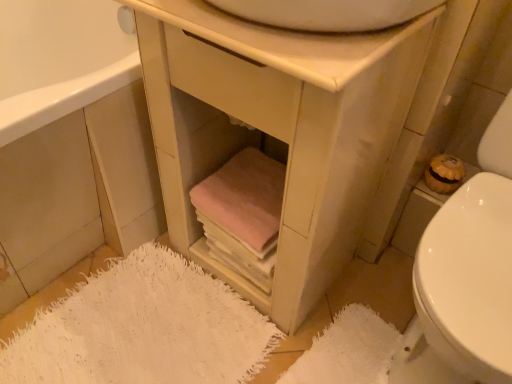
Question: Does white textured bath mat at lower right, the 1th bath mat positioned from the right, have a greater height compared to matte white vanity at center?

Choices:
 (A) no
 (B) yes

Answer: (A)

Question: Does white textured bath mat at lower right, the 2th bath mat positioned from the left, come in front of matte white vanity at center?

Choices:
 (A) yes
 (B) no

Answer: (B)

Question: Is white textured bath mat at lower right, the 1th bath mat positioned from the right, wider than matte white vanity at center?

Choices:
 (A) yes
 (B) no

Answer: (B)

Question: From a real-world perspective, is white textured bath mat at lower right, the 1th bath mat positioned from the right, located higher than matte white vanity at center?

Choices:
 (A) yes
 (B) no

Answer: (B)

Question: Considering the relative positions of white textured bath mat at lower right, the 2th bath mat positioned from the left, and matte white vanity at center in the image provided, is white textured bath mat at lower right, the 2th bath mat positioned from the left, behind matte white vanity at center?

Choices:
 (A) yes
 (B) no

Answer: (A)

Question: Considering the relative sizes of white textured bath mat at lower right, the 2th bath mat positioned from the left, and matte white vanity at center in the image provided, is white textured bath mat at lower right, the 2th bath mat positioned from the left, smaller than matte white vanity at center?

Choices:
 (A) no
 (B) yes

Answer: (B)

Question: Can you confirm if white glossy toilet at lower right is taller than white fuzzy bath mat at lower left, which is counted as the second bath mat, starting from the right?

Choices:
 (A) yes
 (B) no

Answer: (A)

Question: From the image's perspective, is white glossy toilet at lower right located beneath white fuzzy bath mat at lower left, which is counted as the second bath mat, starting from the right?

Choices:
 (A) yes
 (B) no

Answer: (B)

Question: Does white glossy toilet at lower right have a greater width compared to white fuzzy bath mat at lower left, which is counted as the second bath mat, starting from the right?

Choices:
 (A) no
 (B) yes

Answer: (B)

Question: Is white glossy toilet at lower right far from white fuzzy bath mat at lower left, which is counted as the second bath mat, starting from the right?

Choices:
 (A) no
 (B) yes

Answer: (A)

Question: From a real-world perspective, is white glossy toilet at lower right physically above white fuzzy bath mat at lower left, arranged as the first bath mat when viewed from the left?

Choices:
 (A) yes
 (B) no

Answer: (A)

Question: Is the depth of white glossy toilet at lower right less than that of white fuzzy bath mat at lower left, arranged as the first bath mat when viewed from the left?

Choices:
 (A) yes
 (B) no

Answer: (A)

Question: Is matte wood cabinet at lower left further to the viewer compared to white textured bath mat at lower right, the 1th bath mat positioned from the right?

Choices:
 (A) no
 (B) yes

Answer: (A)